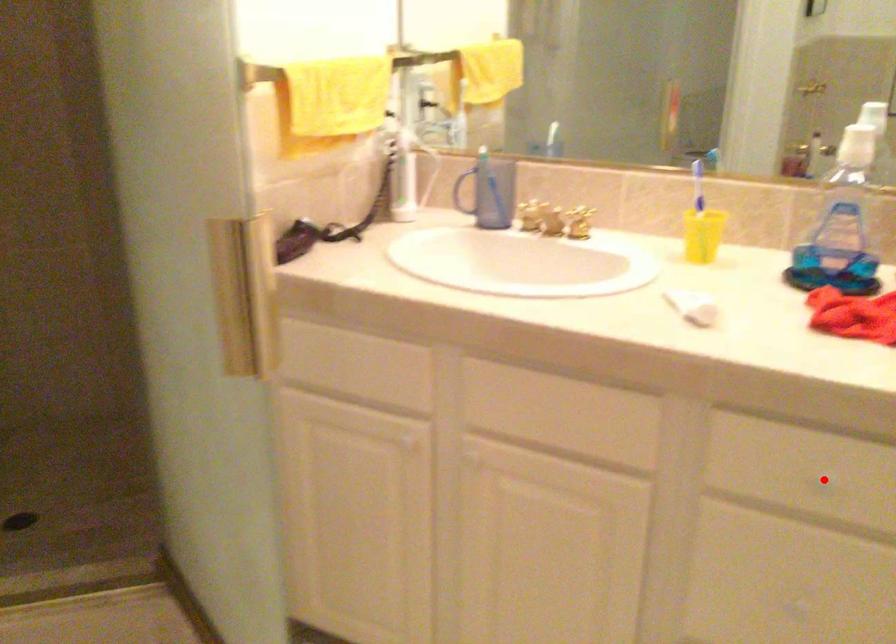
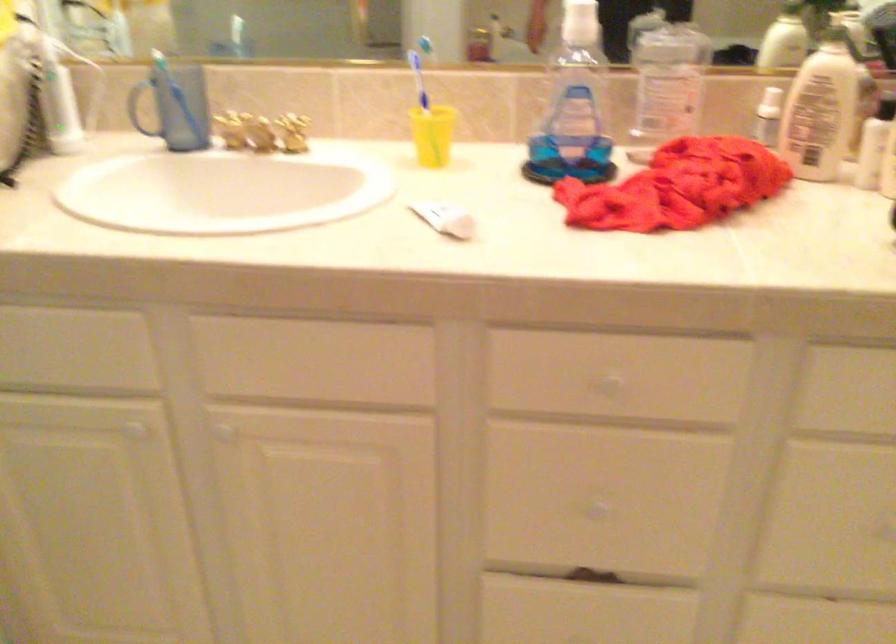
Where in the second image is the point corresponding to the highlighted location from the first image?

(609, 384)